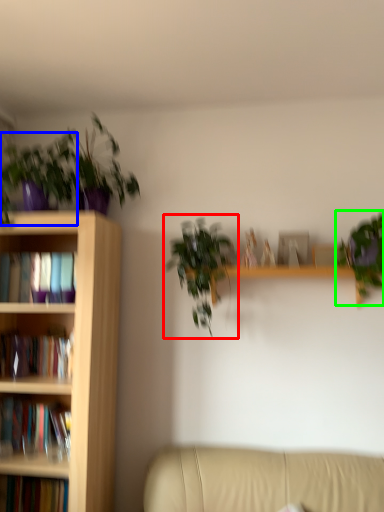
Question: Which is nearer to the houseplant (highlighted by a red box)? houseplant (highlighted by a blue box) or houseplant (highlighted by a green box).

Choices:
 (A) houseplant
 (B) houseplant

Answer: (B)